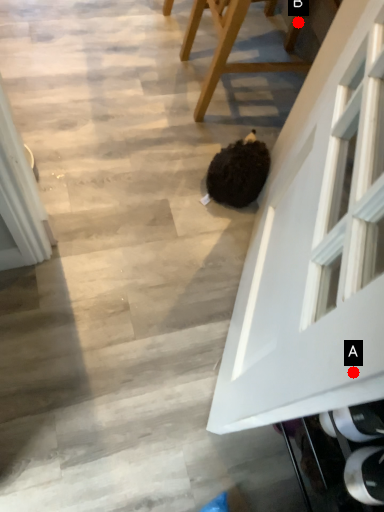
Question: Two points are circled on the image, labeled by A and B beside each circle. Among these points, which one is nearest to the camera?

Choices:
 (A) A is closer
 (B) B is closer

Answer: (A)